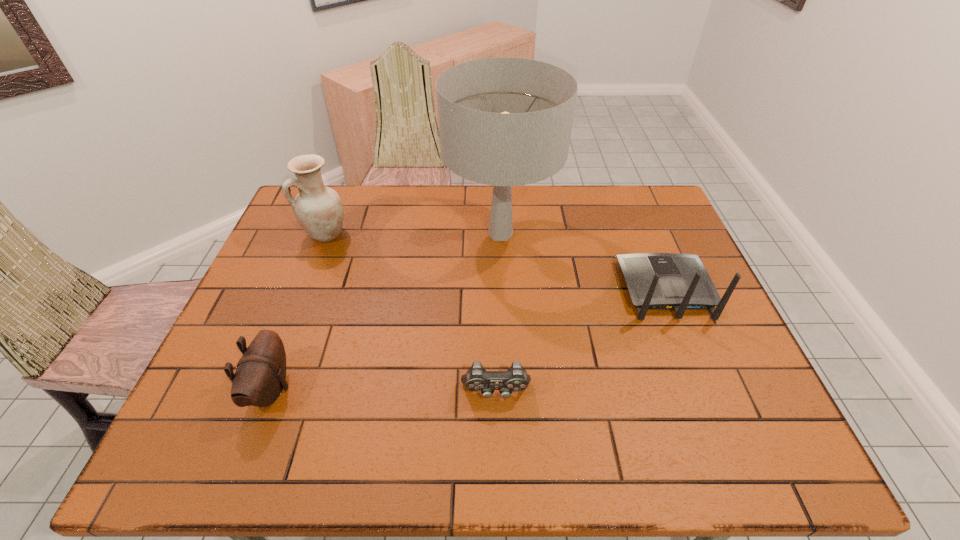
Find the location of `the tallest object`. the tallest object is located at coordinates (503, 121).

The width and height of the screenshot is (960, 540). What are the coordinates of `pottery` in the screenshot? It's located at (318, 209).

Image resolution: width=960 pixels, height=540 pixels. I want to click on router, so click(656, 281).

The width and height of the screenshot is (960, 540). Identify the location of pouch. (260, 377).

I want to click on control, so click(476, 379).

The height and width of the screenshot is (540, 960). I want to click on vacant region located 0.260m on the front-facing side of the tallest object, so click(x=364, y=234).

Find the location of `vacant space located 0.130m on the front-facing side of the tallest object`. vacant space located 0.130m on the front-facing side of the tallest object is located at coordinates (405, 234).

Locate an element on the screen. free space located 0.360m on the front-facing side of the tallest object is located at coordinates (332, 234).

Where is `vacant region located on the right of the pottery`? vacant region located on the right of the pottery is located at coordinates 435,234.

Find the location of a particular element. The width and height of the screenshot is (960, 540). vacant space situated 0.330m on the front-facing side of the router is located at coordinates (628, 197).